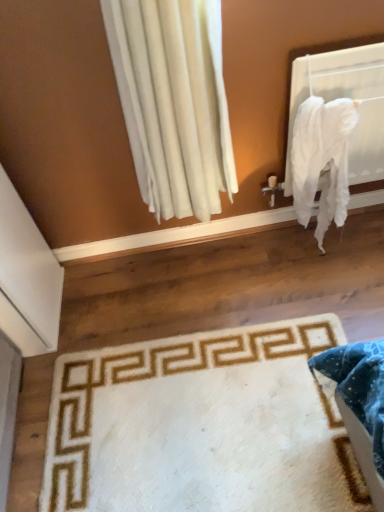
At what (x,y) coordinates should I click in order to perform the action: click on vacant space that's between white cotton blanket at right and white plush rug at lower center. Please return your answer as a coordinate pair (x, y). The height and width of the screenshot is (512, 384). Looking at the image, I should click on (237, 300).